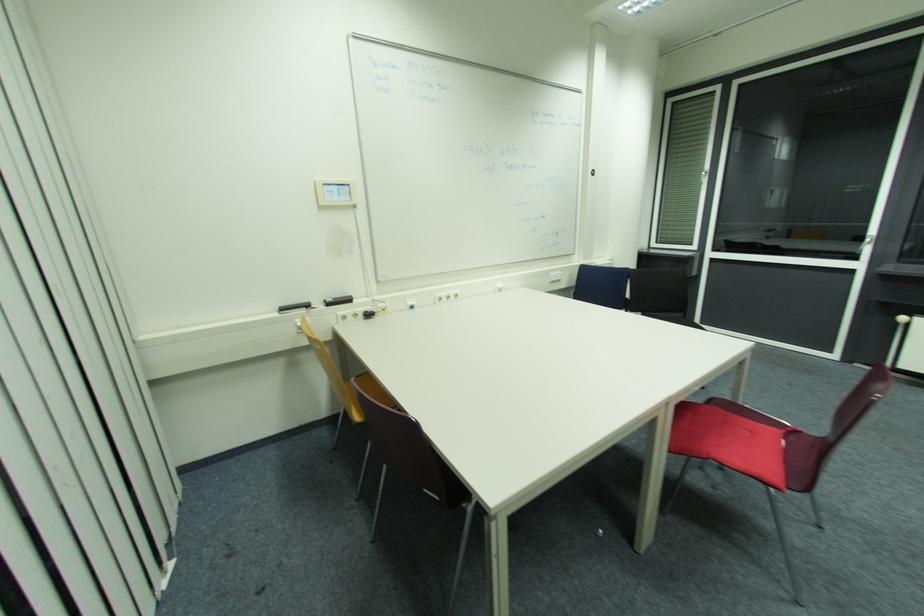
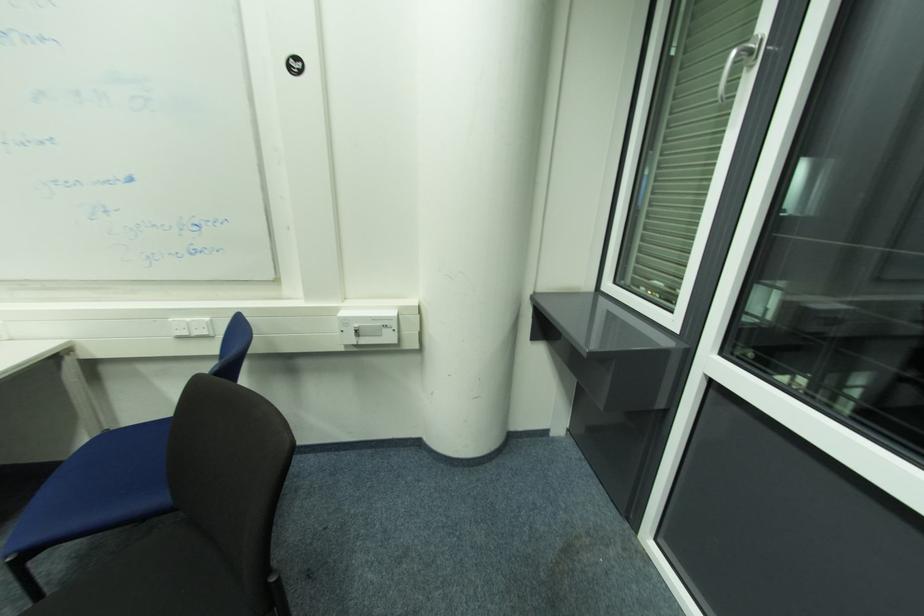
Find the pixel in the second image that matches [613,265] in the first image.

(378, 320)